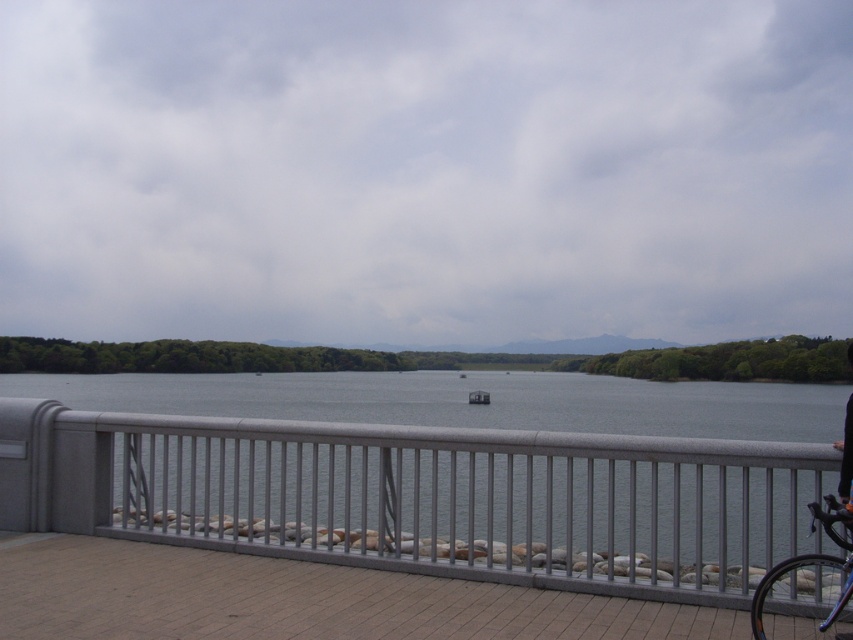
You are standing on the paved walkway and want to know the exact position of the satin silver railing at center. Can you determine its coordinates based on the scene?

The satin silver railing at center is located at point (x=425, y=497).

You are standing on the paved walkway and want to know if the satin silver railing at center is wider than the shiny black bicycle at right. Can you determine this based on the scene?

The satin silver railing at center is wider than the shiny black bicycle at right according to the description.

You are standing on the walkway and want to reach the point at coordinates point (425, 497). Is this point located on the railing or the walkway?

The point (425, 497) is on the satin silver railing at center, so it is located on the railing.